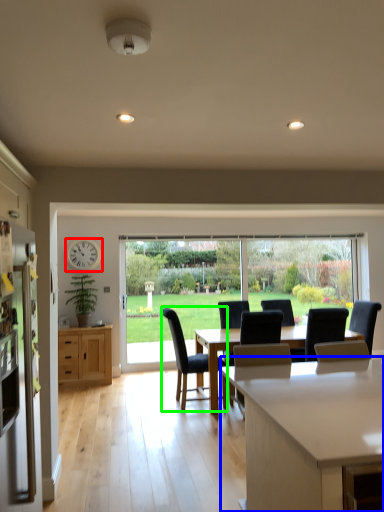
Question: Estimate the real-world distances between objects in this image. Which object is closer to clock (highlighted by a red box), countertop (highlighted by a blue box) or chair (highlighted by a green box)?

Choices:
 (A) countertop
 (B) chair

Answer: (B)